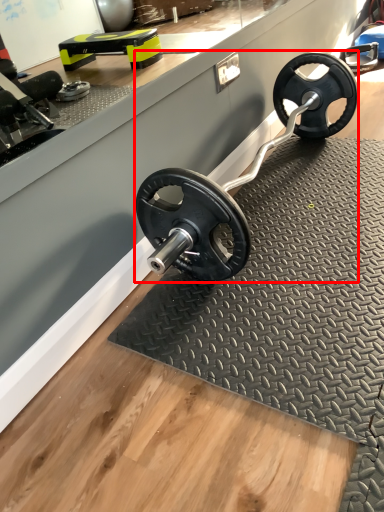
Question: From the image's perspective, considering the relative positions of sport equipment (annotated by the red box) and mat in the image provided, where is sport equipment (annotated by the red box) located with respect to the staircase?

Choices:
 (A) below
 (B) above

Answer: (B)